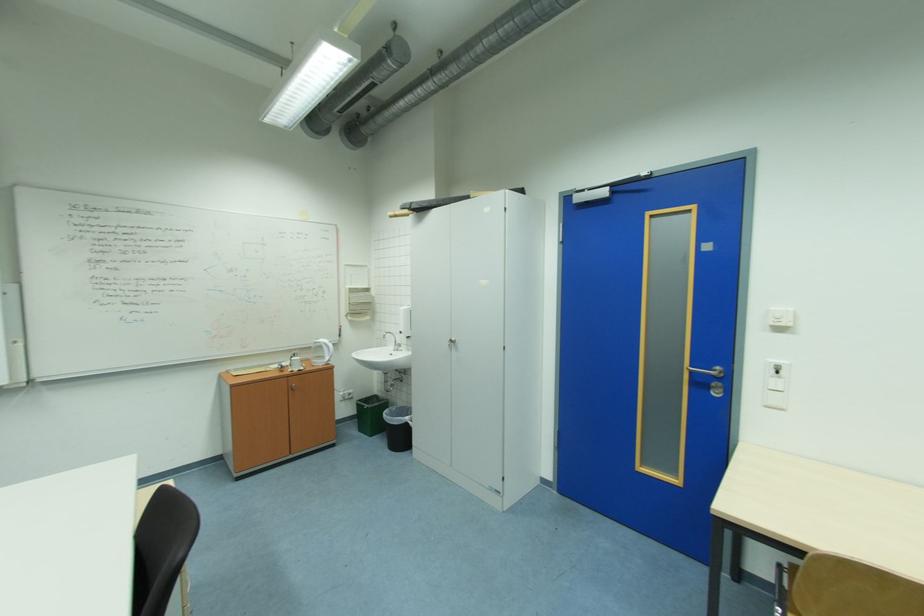
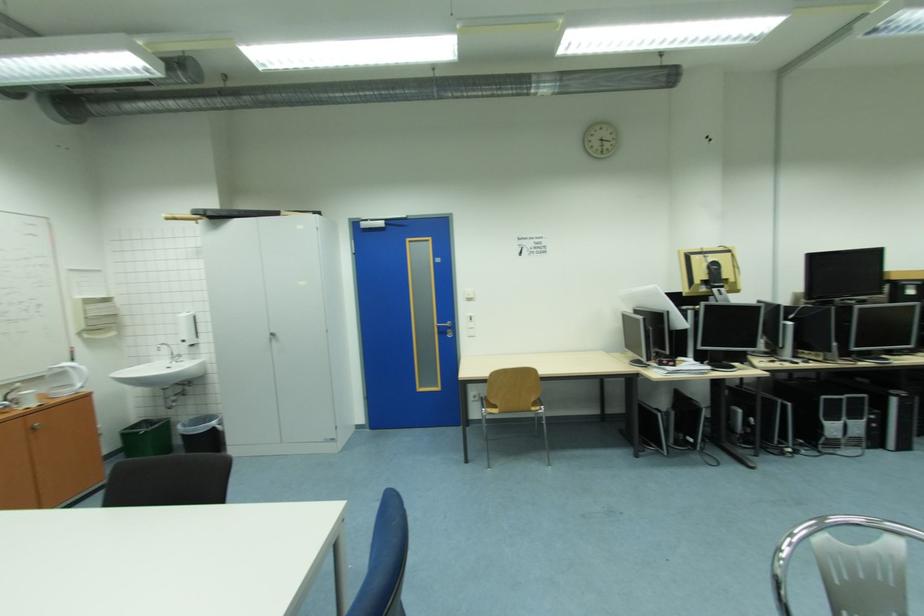
Locate, in the second image, the point that corresponds to point (359, 292) in the first image.

(94, 302)